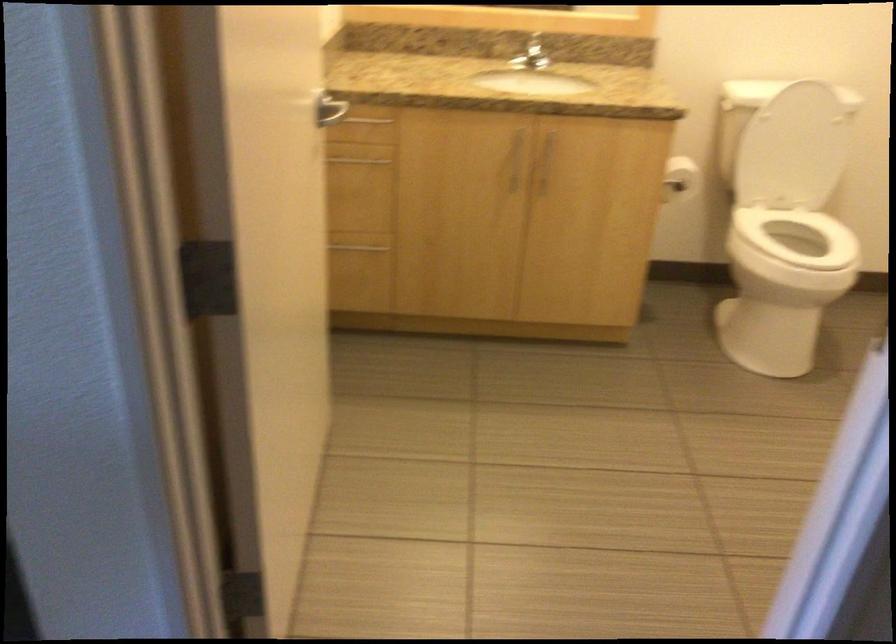
The height and width of the screenshot is (644, 896). What do you see at coordinates (530, 55) in the screenshot?
I see `the faucet handle` at bounding box center [530, 55].